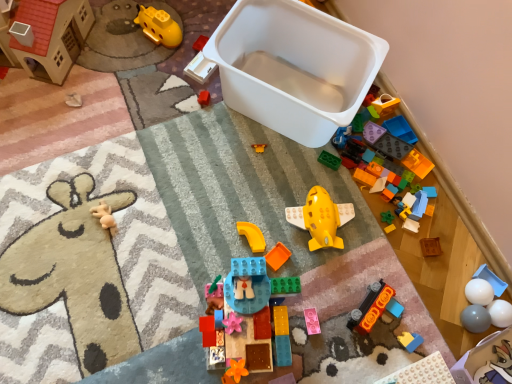
You are a GUI agent. You are given a task and a screenshot of the screen. Output one action in this format:
    pyautogui.click(x=<x>, y=<y>)
    Task: Click on the free space in front of yellow plastic submarine at upper left, which ranks as the fourteenth toy in right-to-left order
    Image resolution: width=512 pixels, height=384 pixels.
    Given the screenshot: What is the action you would take?
    pyautogui.click(x=146, y=76)